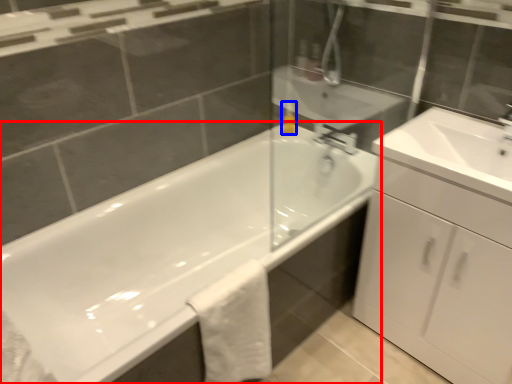
Question: Which of the following is the closest to the observer, bathtub (highlighted by a red box) or soap dispenser (highlighted by a blue box)?

Choices:
 (A) bathtub
 (B) soap dispenser

Answer: (A)